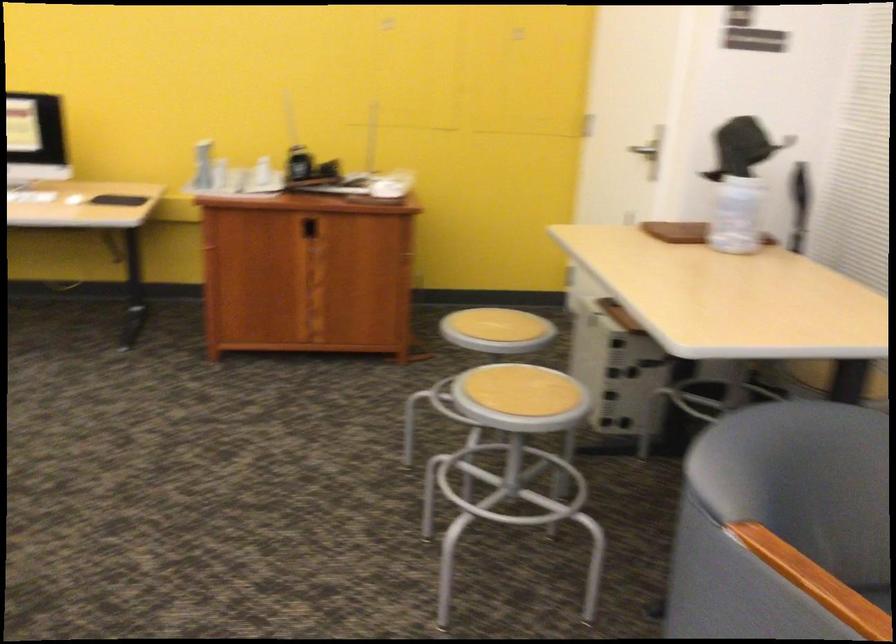
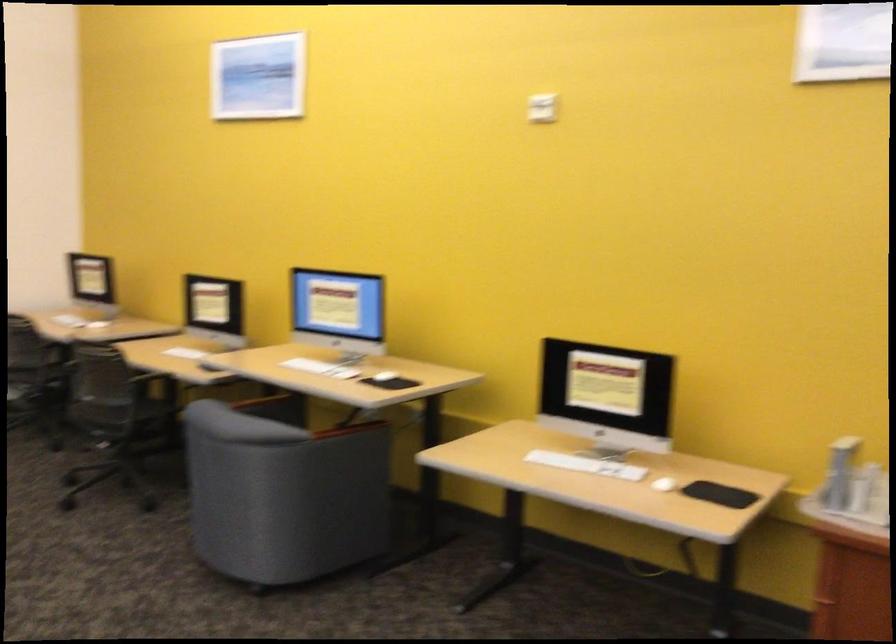
Question: The camera is either moving clockwise (left) or counter-clockwise (right) around the object. The first image is from the beginning of the video and the second image is from the end. Is the camera moving left or right when shooting the video?

Choices:
 (A) Left
 (B) Right

Answer: (B)